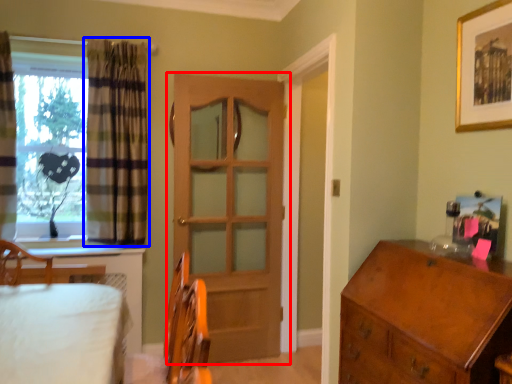
Question: Among these objects, which one is nearest to the camera, door (highlighted by a red box) or curtain (highlighted by a blue box)?

Choices:
 (A) door
 (B) curtain

Answer: (B)